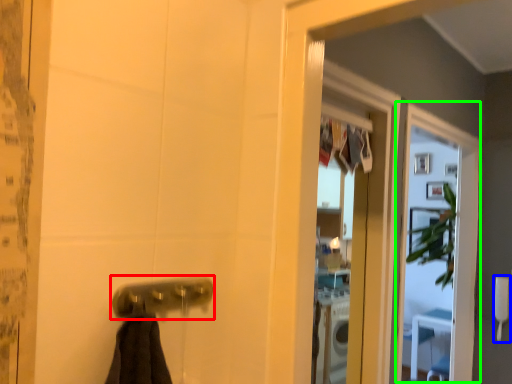
Question: Based on their relative distances, which object is farther from door handle (highlighted by a red box)? Choose from towel bar (highlighted by a blue box) and screen door (highlighted by a green box).

Choices:
 (A) towel bar
 (B) screen door

Answer: (A)